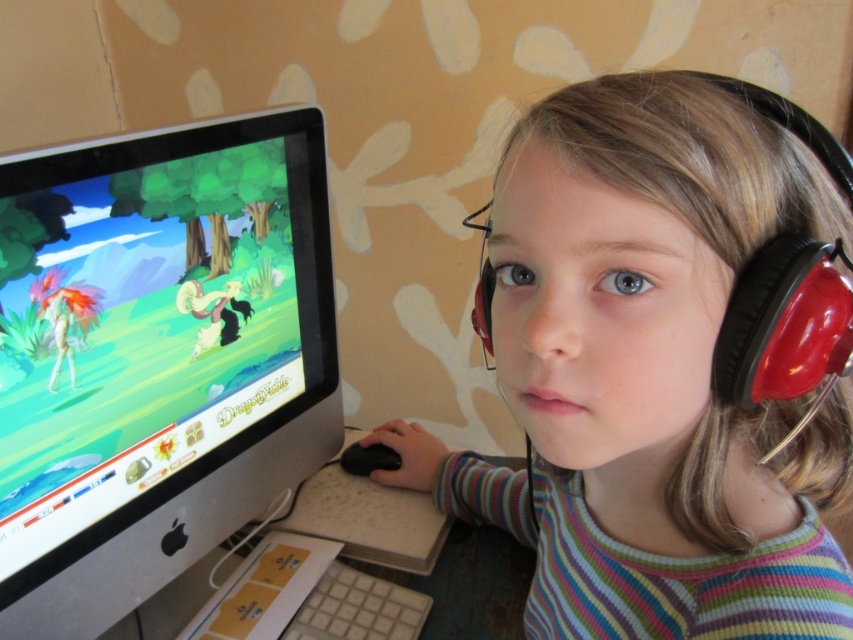
Question: Does black matte headphones at upper right appear on the right side of satin black monitor at left?

Choices:
 (A) yes
 (B) no

Answer: (A)

Question: Which point is closer to the camera taking this photo?

Choices:
 (A) (691, 572)
 (B) (49, 600)

Answer: (A)

Question: Does black matte headphones at upper right come in front of satin black monitor at left?

Choices:
 (A) no
 (B) yes

Answer: (B)

Question: Is black matte headphones at upper right further to camera compared to satin black monitor at left?

Choices:
 (A) no
 (B) yes

Answer: (A)

Question: Which point is closer to the camera?

Choices:
 (A) black matte headphones at upper right
 (B) satin black monitor at left

Answer: (A)

Question: Which point is closer to the camera?

Choices:
 (A) satin black monitor at left
 (B) black matte headphones at upper right

Answer: (B)